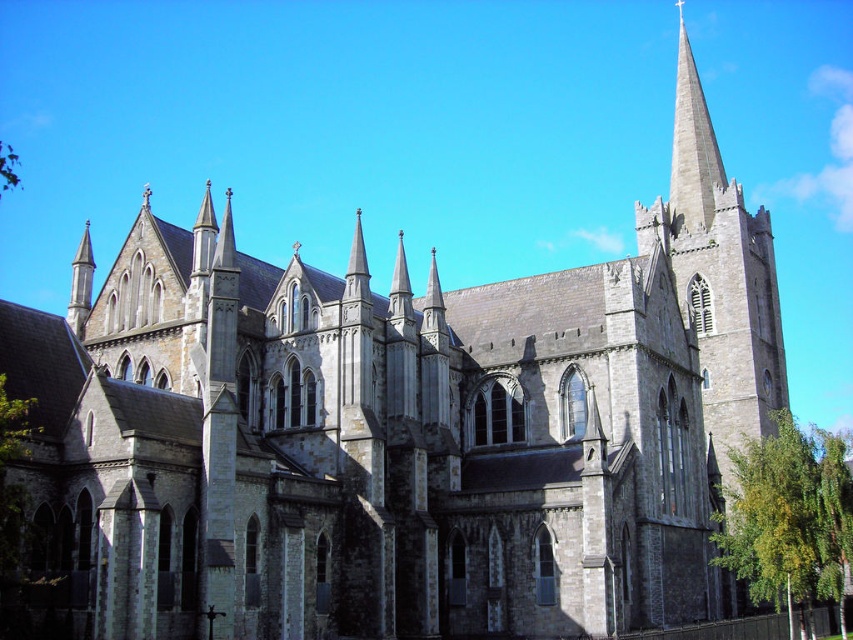
You are standing in front of the cathedral and notice a green leafy tree at lower right and a gray stone spire at upper right. Which object is positioned to the left of the other?

The green leafy tree at lower right is to the left of the gray stone spire at upper right.

You are a tourist standing in front of the cathedral. You notice a green leafy tree at lower right and a gray stone spire at upper right. Which object appears larger in the image?

The gray stone spire at upper right appears larger than the green leafy tree at lower right.

You are standing in front of the cathedral and want to take a photo that includes both the green leafy tree at lower right and the central spire. Given that your camera has a maximum zoom of 50 meters, can you capture both in the same frame without moving?

The green leafy tree at lower right is 56.39 meters away from the viewer. Since the camera can only zoom up to 50 meters, it cannot capture the tree in the same frame as the central spire without moving closer.